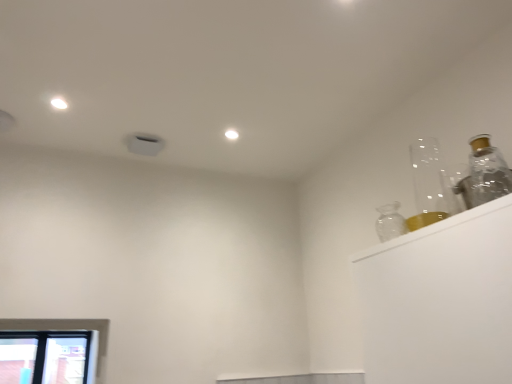
Question: Does clear glass window at lower left have a lesser width compared to transparent glass bottle at upper right?

Choices:
 (A) no
 (B) yes

Answer: (A)

Question: Is clear glass window at lower left positioned before transparent glass bottle at upper right?

Choices:
 (A) no
 (B) yes

Answer: (A)

Question: Does clear glass window at lower left turn towards transparent glass bottle at upper right?

Choices:
 (A) yes
 (B) no

Answer: (A)

Question: Does clear glass window at lower left have a lesser height compared to transparent glass bottle at upper right?

Choices:
 (A) yes
 (B) no

Answer: (B)

Question: Considering the relative sizes of clear glass window at lower left and transparent glass bottle at upper right in the image provided, is clear glass window at lower left bigger than transparent glass bottle at upper right?

Choices:
 (A) no
 (B) yes

Answer: (B)

Question: Is clear glass window at lower left turned away from transparent glass bottle at upper right?

Choices:
 (A) no
 (B) yes

Answer: (A)

Question: Considering the relative sizes of transparent glass bottle at upper right and clear glass window at lower left in the image provided, is transparent glass bottle at upper right bigger than clear glass window at lower left?

Choices:
 (A) yes
 (B) no

Answer: (B)

Question: Would you say transparent glass bottle at upper right is a long distance from clear glass window at lower left?

Choices:
 (A) no
 (B) yes

Answer: (B)

Question: Is transparent glass bottle at upper right wider than clear glass window at lower left?

Choices:
 (A) no
 (B) yes

Answer: (A)

Question: Is transparent glass bottle at upper right taller than clear glass window at lower left?

Choices:
 (A) yes
 (B) no

Answer: (B)

Question: Is transparent glass bottle at upper right turned away from clear glass window at lower left?

Choices:
 (A) yes
 (B) no

Answer: (B)

Question: Does transparent glass bottle at upper right come behind clear glass window at lower left?

Choices:
 (A) yes
 (B) no

Answer: (B)

Question: Considering the positions of clear glass window at lower left and transparent glass bottle at upper right in the image, is clear glass window at lower left taller or shorter than transparent glass bottle at upper right?

Choices:
 (A) short
 (B) tall

Answer: (B)